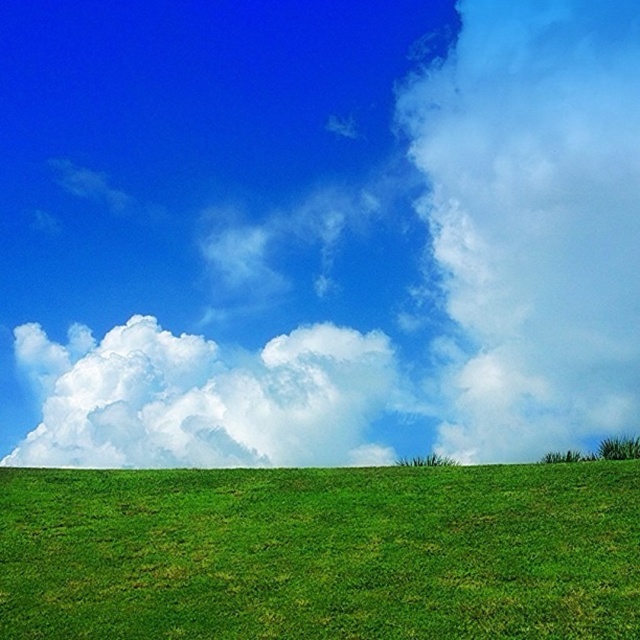
Question: Does green grassy hill at lower center have a larger size compared to white fluffy cloud at center?

Choices:
 (A) yes
 (B) no

Answer: (A)

Question: Among these points, which one is farthest from the camera?

Choices:
 (A) (467, 618)
 (B) (243, 426)

Answer: (B)

Question: Which object is positioned closest to the green grass at lower center?

Choices:
 (A) white fluffy cloud at center
 (B) green grassy hill at lower center

Answer: (A)

Question: Based on their relative distances, which object is nearer to the green grassy hill at lower center?

Choices:
 (A) white fluffy cloud at center
 (B) green grass at lower center

Answer: (B)

Question: Is green grass at lower center above green grassy hill at lower center?

Choices:
 (A) no
 (B) yes

Answer: (B)

Question: Is green grassy hill at lower center below white fluffy cloud at center?

Choices:
 (A) yes
 (B) no

Answer: (A)